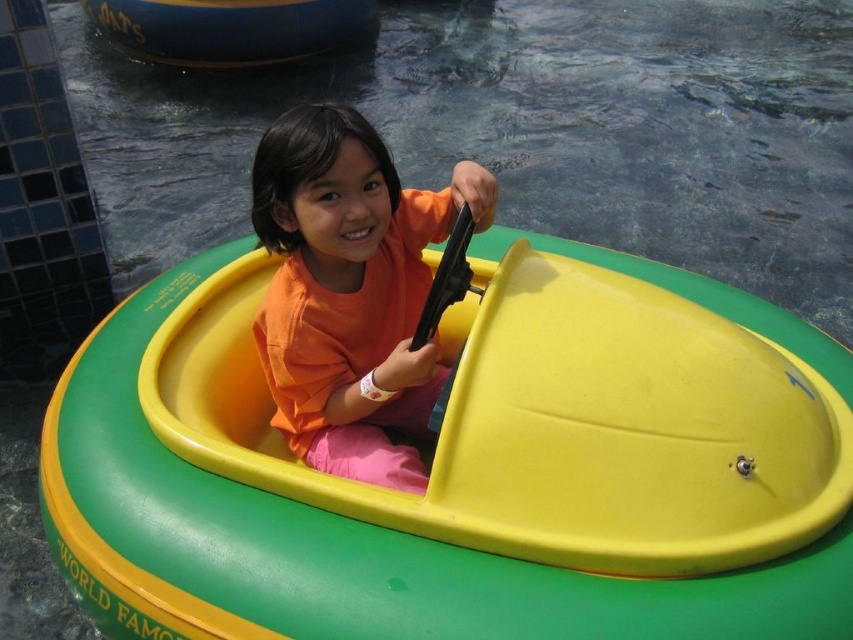
Question: Where is orange matte shirt at center located in relation to blue rubber boat at upper left in the image?

Choices:
 (A) right
 (B) left

Answer: (A)

Question: Is yellow matte plastic boat at center thinner than orange matte shirt at center?

Choices:
 (A) yes
 (B) no

Answer: (B)

Question: Based on their relative distances, which object is nearer to the orange matte shirt at center?

Choices:
 (A) blue rubber boat at upper left
 (B) yellow matte plastic boat at center

Answer: (B)

Question: Which object is the closest to the blue rubber boat at upper left?

Choices:
 (A) orange matte shirt at center
 (B) yellow matte plastic boat at center

Answer: (B)

Question: Considering the relative positions of orange matte shirt at center and blue rubber boat at upper left in the image provided, where is orange matte shirt at center located with respect to blue rubber boat at upper left?

Choices:
 (A) above
 (B) below

Answer: (B)

Question: Which of these objects is positioned closest to the blue rubber boat at upper left?

Choices:
 (A) orange matte shirt at center
 (B) yellow matte plastic boat at center

Answer: (B)